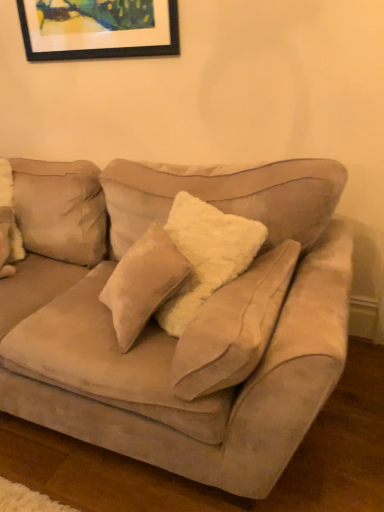
This screenshot has width=384, height=512. I want to click on matte black picture frame at upper center, so click(98, 29).

What do you see at coordinates (98, 29) in the screenshot? I see `matte black picture frame at upper center` at bounding box center [98, 29].

Find the location of `suede couch at center`. suede couch at center is located at coordinates (190, 326).

In order to face suede couch at center, should I rotate leftwards or rightwards?

Rotate left and turn 15.489 degrees.

What is the approximate width of suede couch at center?

The width of suede couch at center is 1.10 meters.

This screenshot has width=384, height=512. What do you see at coordinates (190, 326) in the screenshot?
I see `suede couch at center` at bounding box center [190, 326].

At what (x,y) coordinates should I click in order to perform the action: click on matte black picture frame at upper center. Please return your answer as a coordinate pair (x, y). Image resolution: width=384 pixels, height=512 pixels. Looking at the image, I should click on (98, 29).

In the scene shown: Would you say matte black picture frame at upper center is to the left or to the right of suede couch at center in the picture?

matte black picture frame at upper center is positioned on suede couch at center's right side.

Considering the relative positions of matte black picture frame at upper center and suede couch at center in the image provided, is matte black picture frame at upper center behind suede couch at center?

Yes.

Is point (176, 42) less distant than point (343, 304)?

That is False.

From the image's perspective, relative to suede couch at center, is matte black picture frame at upper center above or below?

Clearly, from the image's perspective, matte black picture frame at upper center is above suede couch at center.

From a real-world perspective, which is physically above, matte black picture frame at upper center or suede couch at center?

matte black picture frame at upper center.

In terms of width, does matte black picture frame at upper center look wider or thinner when compared to suede couch at center?

Considering their sizes, matte black picture frame at upper center looks slimmer than suede couch at center.

Does matte black picture frame at upper center have a lesser height compared to suede couch at center?

Indeed, matte black picture frame at upper center has a lesser height compared to suede couch at center.

Which of these two, matte black picture frame at upper center or suede couch at center, is smaller?

Smaller between the two is matte black picture frame at upper center.

Would you say matte black picture frame at upper center is outside suede couch at center?

Yes, matte black picture frame at upper center is not within suede couch at center.

Is matte black picture frame at upper center touching suede couch at center?

No.

Is matte black picture frame at upper center aimed at suede couch at center?

No, matte black picture frame at upper center does not turn towards suede couch at center.

How many degrees apart are the facing directions of matte black picture frame at upper center and suede couch at center?

The facing directions of matte black picture frame at upper center and suede couch at center are 0.538 degrees apart.

Measure the distance from matte black picture frame at upper center to suede couch at center.

matte black picture frame at upper center and suede couch at center are 3.48 feet apart.

Where is `picture frame above the suede couch at center (from a real-world perspective)`? This screenshot has width=384, height=512. picture frame above the suede couch at center (from a real-world perspective) is located at coordinates (98, 29).

Between suede couch at center and matte black picture frame at upper center, which one appears on the left side from the viewer's perspective?

From the viewer's perspective, suede couch at center appears more on the left side.

From the picture: Is suede couch at center in front of or behind matte black picture frame at upper center in the image?

In the image, suede couch at center appears in front of matte black picture frame at upper center.

Consider the image. Which point is more forward, (348, 241) or (152, 41)?

The point (348, 241) is in front.

Consider the image. From the image's perspective, which one is positioned higher, suede couch at center or matte black picture frame at upper center?

matte black picture frame at upper center is shown above in the image.

From a real-world perspective, who is located lower, suede couch at center or matte black picture frame at upper center?

In real-world perspective, suede couch at center is lower.

Is suede couch at center wider or thinner than matte black picture frame at upper center?

Considering their sizes, suede couch at center looks broader than matte black picture frame at upper center.

Does suede couch at center have a lesser height compared to matte black picture frame at upper center?

No, suede couch at center is not shorter than matte black picture frame at upper center.

Considering the sizes of objects suede couch at center and matte black picture frame at upper center in the image provided, who is smaller, suede couch at center or matte black picture frame at upper center?

matte black picture frame at upper center is smaller.

Is suede couch at center surrounding matte black picture frame at upper center?

Definitely not — matte black picture frame at upper center is not inside suede couch at center.

Are suede couch at center and matte black picture frame at upper center far apart?

Indeed, suede couch at center is not near matte black picture frame at upper center.

Does suede couch at center turn towards matte black picture frame at upper center?

No, suede couch at center is not aimed at matte black picture frame at upper center.

How many degrees apart are the facing directions of suede couch at center and matte black picture frame at upper center?

The angular difference between suede couch at center and matte black picture frame at upper center is 0.538 degrees.

Looking at this image, how much distance is there between suede couch at center and matte black picture frame at upper center?

1.06 meters.

Where is `studio couch in front of the matte black picture frame at upper center`? This screenshot has height=512, width=384. studio couch in front of the matte black picture frame at upper center is located at coordinates (190, 326).

Image resolution: width=384 pixels, height=512 pixels. Identify the location of picture frame above the suede couch at center (from the image's perspective). (98, 29).

Find the location of a particular element. The width and height of the screenshot is (384, 512). picture frame that is behind the suede couch at center is located at coordinates (98, 29).